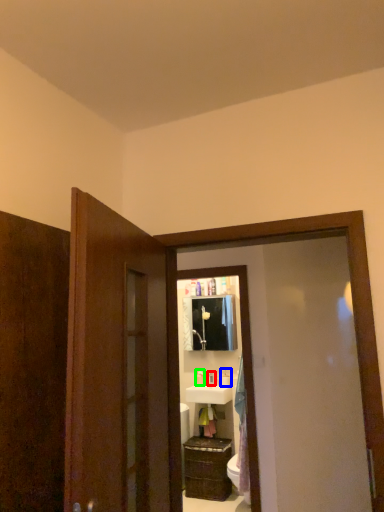
Question: Based on their relative distances, which object is nearer to toiletry (highlighted by a red box)? Choose from toiletry (highlighted by a blue box) and toiletry (highlighted by a green box).

Choices:
 (A) toiletry
 (B) toiletry

Answer: (B)